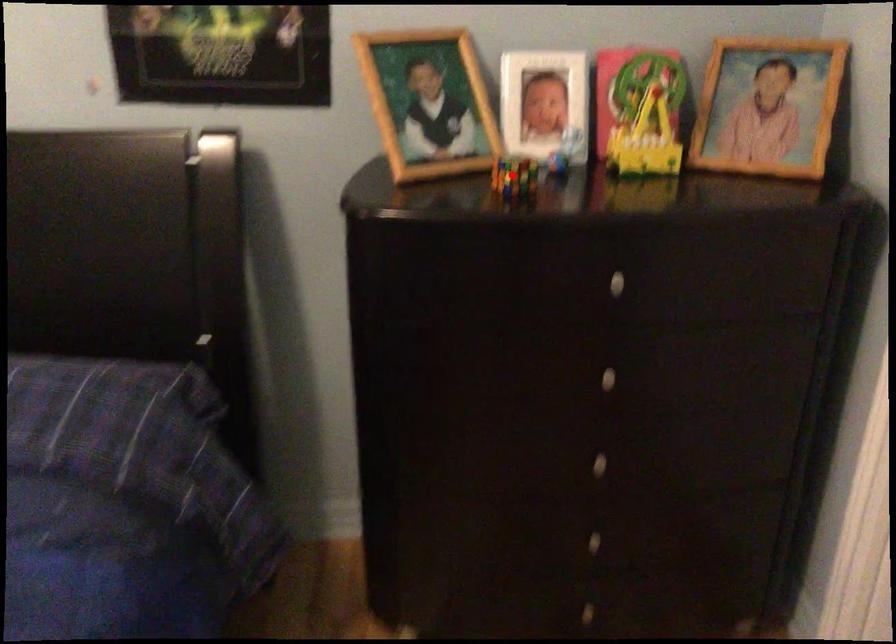
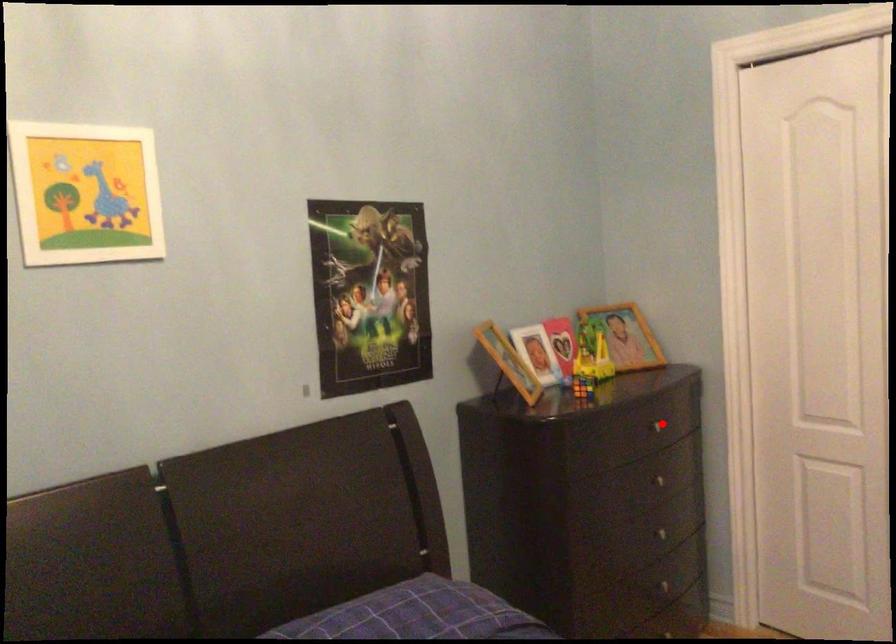
I am providing you with two images of the same scene from different viewpoints. A red point is marked on the first image and another point is marked on the second image. Is the red point in image1 aligned with the point shown in image2?

No